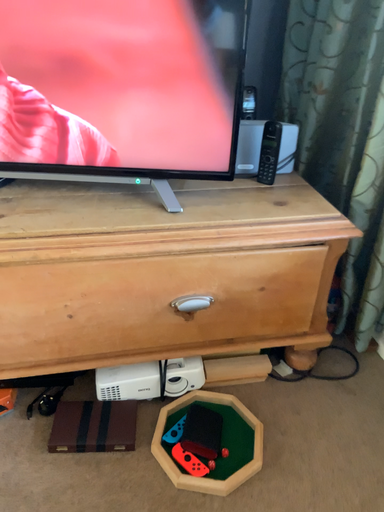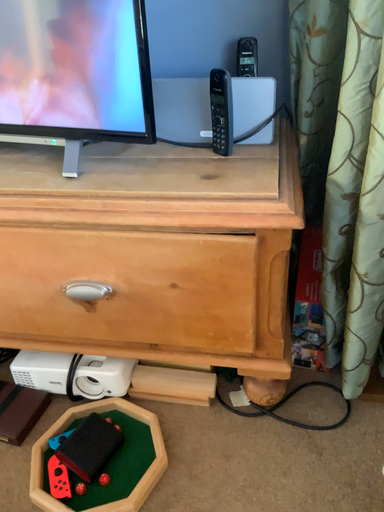
Question: How did the camera likely rotate when shooting the video?

Choices:
 (A) rotated left
 (B) rotated right

Answer: (A)